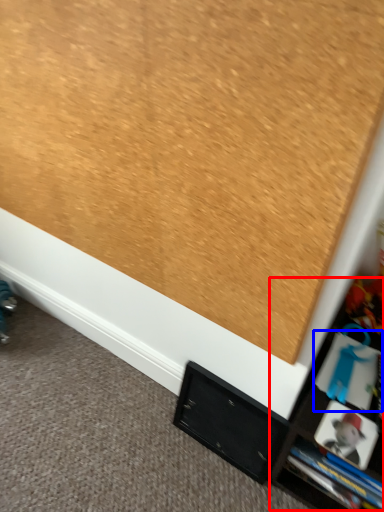
Question: Which object appears closest to the camera in this image, tv cabinet (highlighted by a red box) or book (highlighted by a blue box)?

Choices:
 (A) tv cabinet
 (B) book

Answer: (A)